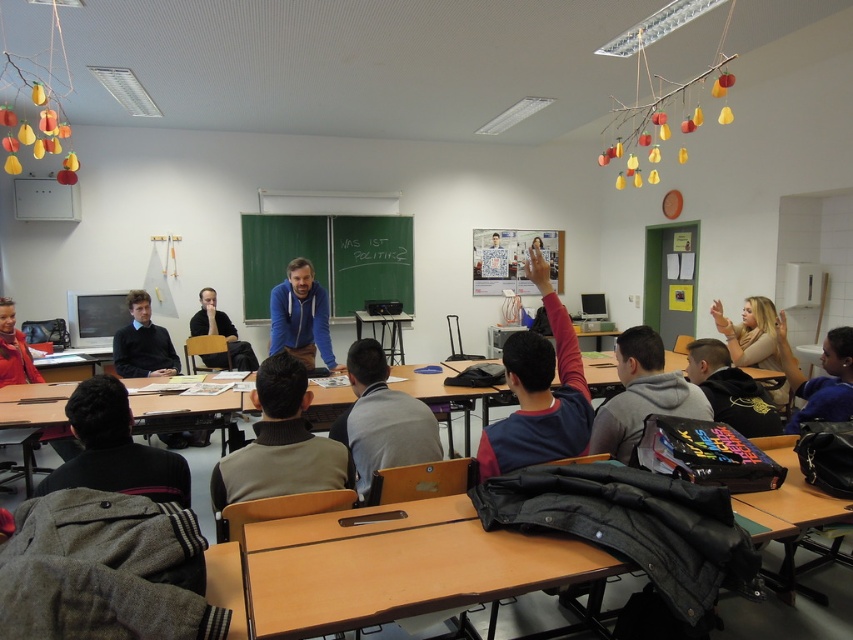
You are a student in the classroom and need to put your backpack on the desk. The backpack requires 30 cm of space. You see the dark gray hoodie at right and the blue hoodie at center. Which desk has enough space for your backpack?

The blue hoodie at center occupies more space than the dark gray hoodie at right. Therefore, the desk with the blue hoodie at center likely has more available space, so you should place your backpack there.

You are a student who wants to borrow a warmer item from the items at the center of the desk. Which one between the dark blue sweater at center and the gray hoodie at center should you choose?

The gray hoodie at center is thicker than the dark blue sweater at center, so you should choose the gray hoodie at center for warmth.